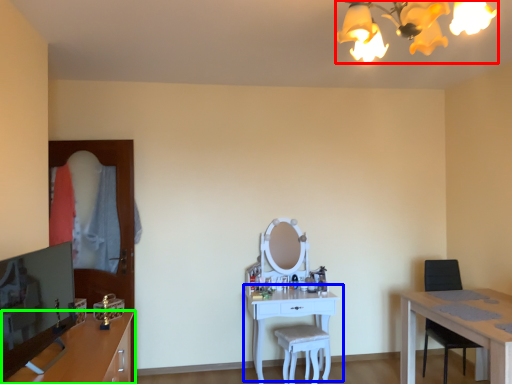
Question: Estimate the real-world distances between objects in this image. Which object is farther from light fixture (highlighted by a red box), table (highlighted by a blue box) or cabinetry (highlighted by a green box)?

Choices:
 (A) table
 (B) cabinetry

Answer: (A)